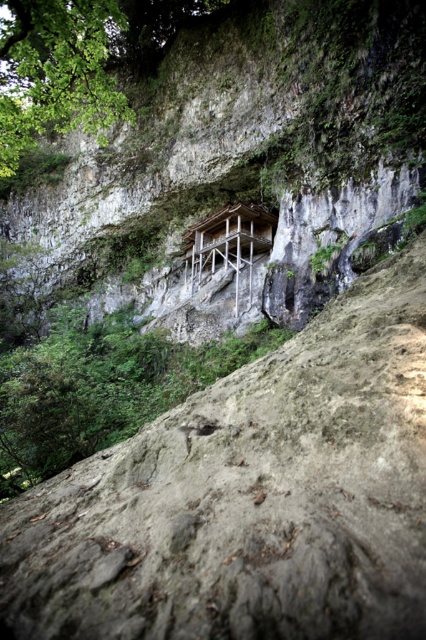
You are a hiker who wants to take a photo of the wooden platform at center from behind the green leafy tree at upper left. Is this possible given their positions?

The green leafy tree at upper left is in front of the wooden platform at center, so yes, you can take a photo of the wooden platform at center from behind the green leafy tree at upper left.

You are standing at the base of the cliff and want to reach the wooden platform at center. You notice a green leafy tree at upper left. Which direction should you move relative to the tree to reach the platform?

The green leafy tree at upper left is positioned on the left side of the wooden platform at center, so you should move to the right of the tree to reach the platform.

You are a hiker standing at the base of the cliff. You want to reach the green leafy tree at upper left. The path is narrow and has a maximum width of 10 meters. Can you safely walk through the path to reach the tree?

The distance between you and the green leafy tree at upper left is 10.57 meters. Since the path has a maximum width of 10 meters, you cannot safely walk through the path to reach the tree because the path is narrower than the required distance.